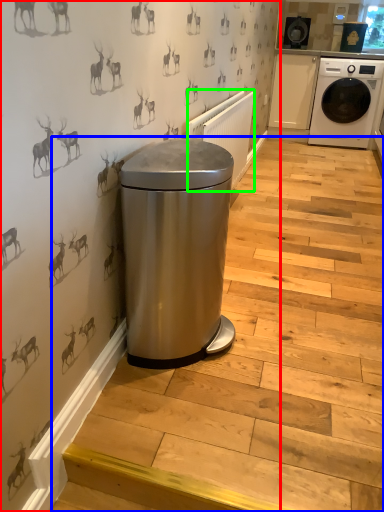
Question: Which object is positioned farthest from backdrop (highlighted by a red box)? Select from stairwell (highlighted by a blue box) and radiator (highlighted by a green box).

Choices:
 (A) stairwell
 (B) radiator

Answer: (A)